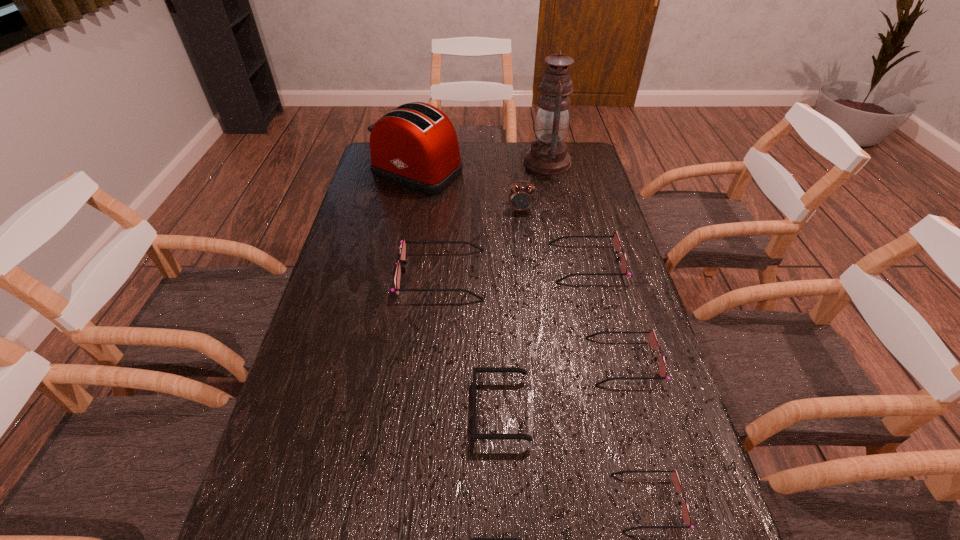
Find the location of a particular element. This screenshot has height=540, width=960. unoccupied area between the bigger black sunglasses and the second smallest pink sunglasses is located at coordinates (563, 385).

The height and width of the screenshot is (540, 960). What are the coordinates of `vacant space in between the nearest pink sunglasses and the red toaster` in the screenshot? It's located at (533, 338).

Locate an element on the screen. free space between the oil lamp and the fifth tallest object is located at coordinates (567, 212).

This screenshot has width=960, height=540. What are the coordinates of `empty space that is in between the second smallest pink sunglasses and the second biggest pink sunglasses` in the screenshot? It's located at (606, 312).

At what (x,y) coordinates should I click in order to perform the action: click on free area in between the seventh shortest object and the second nearest pink sunglasses. Please return your answer as a coordinate pair (x, y). This screenshot has height=540, width=960. Looking at the image, I should click on (572, 285).

Where is `vacant region between the toaster and the alarm clock`? This screenshot has height=540, width=960. vacant region between the toaster and the alarm clock is located at coordinates (469, 191).

Locate which object ranks second in proximity to the farther black sunglasses. Please provide its 2D coordinates. Your answer should be formatted as a tuple, i.e. [(x, y)], where the tuple contains the x and y coordinates of a point satisfying the conditions above.

[(674, 475)]

I want to click on object that stands as the fourth closest to the bigger black sunglasses, so click(403, 242).

The image size is (960, 540). Find the location of `sunglasses that stands as the closest to the red toaster`. sunglasses that stands as the closest to the red toaster is located at coordinates (403, 242).

Locate which sunglasses ranks in proximity to the oil lamp. Please provide its 2D coordinates. Your answer should be formatted as a tuple, i.e. [(x, y)], where the tuple contains the x and y coordinates of a point satisfying the conditions above.

[(617, 245)]